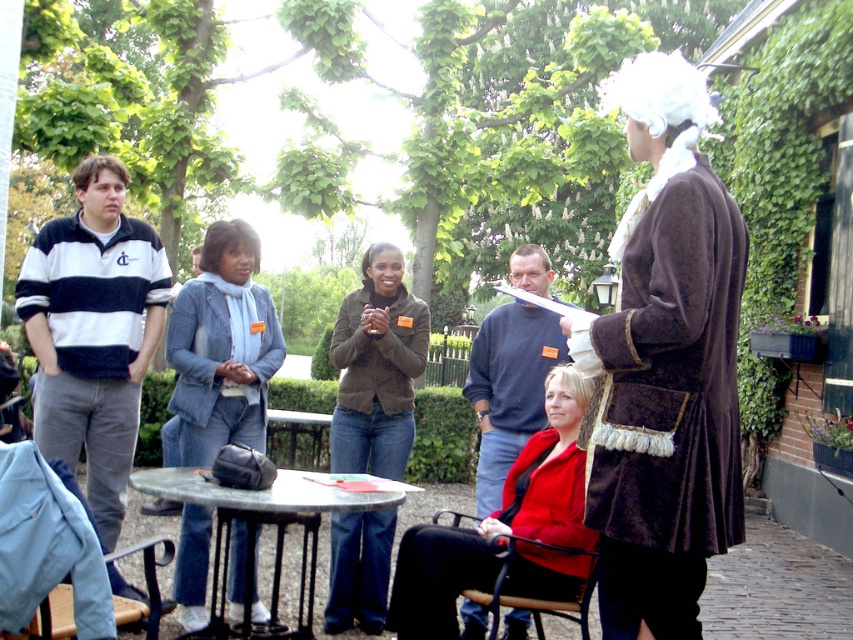
You are a photographer setting up for a photoshoot in a garden courtyard. You notice two wigs on a round metal table surrounded by black metal chairs. The wigs are labeled as the brown silky wig at upper center and the white fluffy wig at center. Which wig is taller?

The brown silky wig at upper center is taller than the white fluffy wig at center.